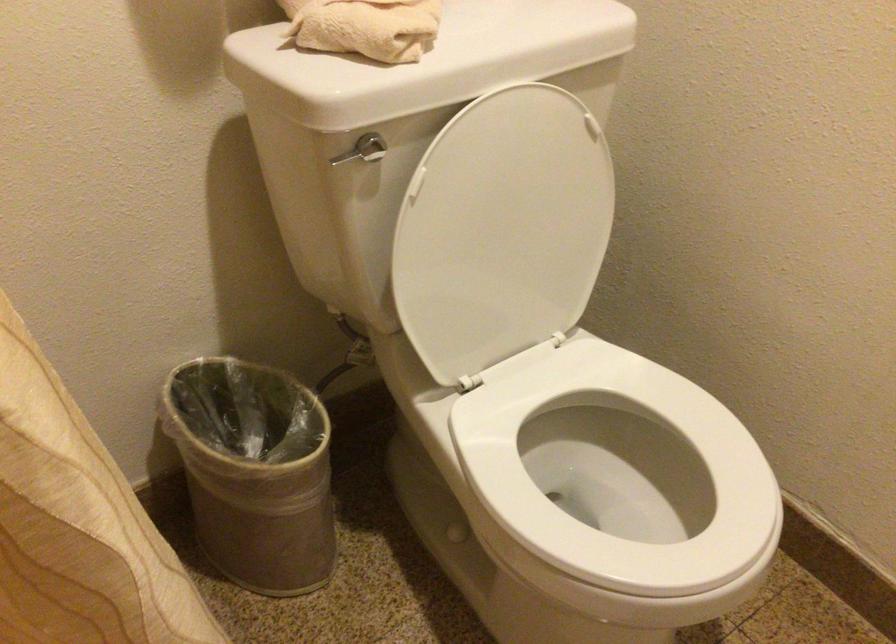
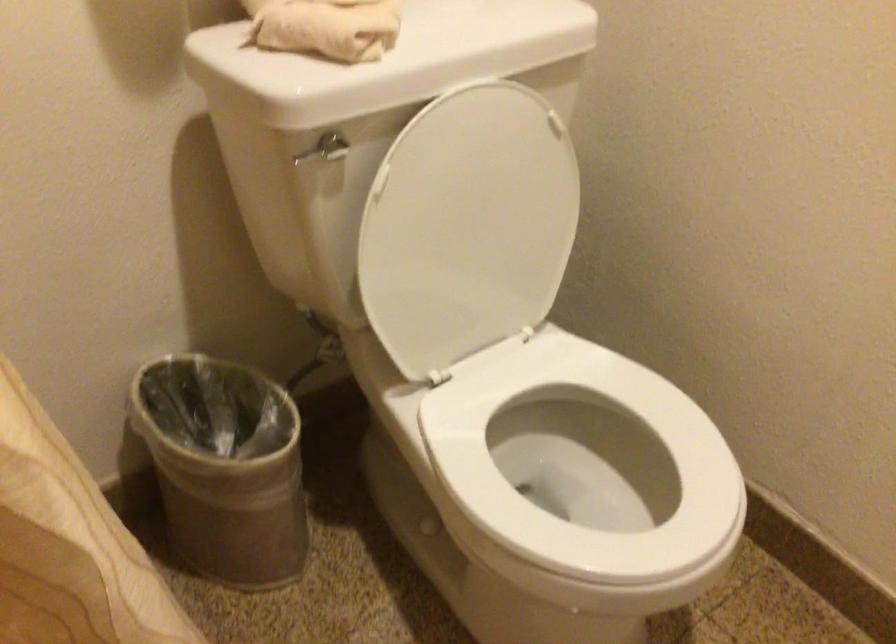
Question: The camera is either moving clockwise (left) or counter-clockwise (right) around the object. The first image is from the beginning of the video and the second image is from the end. Is the camera moving left or right when shooting the video?

Choices:
 (A) Left
 (B) Right

Answer: (A)